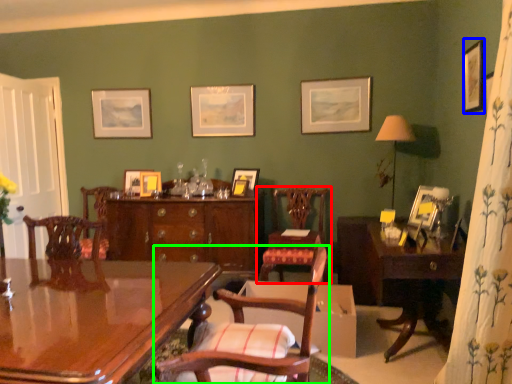
Question: Which object is positioned farthest from chair (highlighted by a red box)? Select from picture frame (highlighted by a blue box) and chair (highlighted by a green box).

Choices:
 (A) picture frame
 (B) chair

Answer: (B)